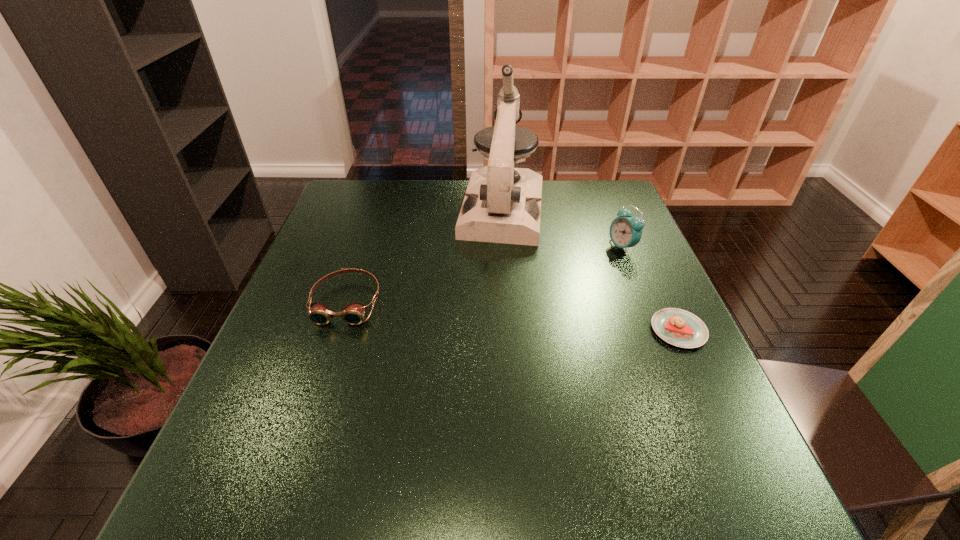
This screenshot has width=960, height=540. What are the coordinates of `vacant spot on the desktop that is between the goggles and the shortest object and is positioned at the eyepiece of the third object from right to left` in the screenshot? It's located at (485, 313).

Identify the location of vacant space on the desktop that is between the goggles and the pastry and is positioned on the face of the alarm clock. (509, 315).